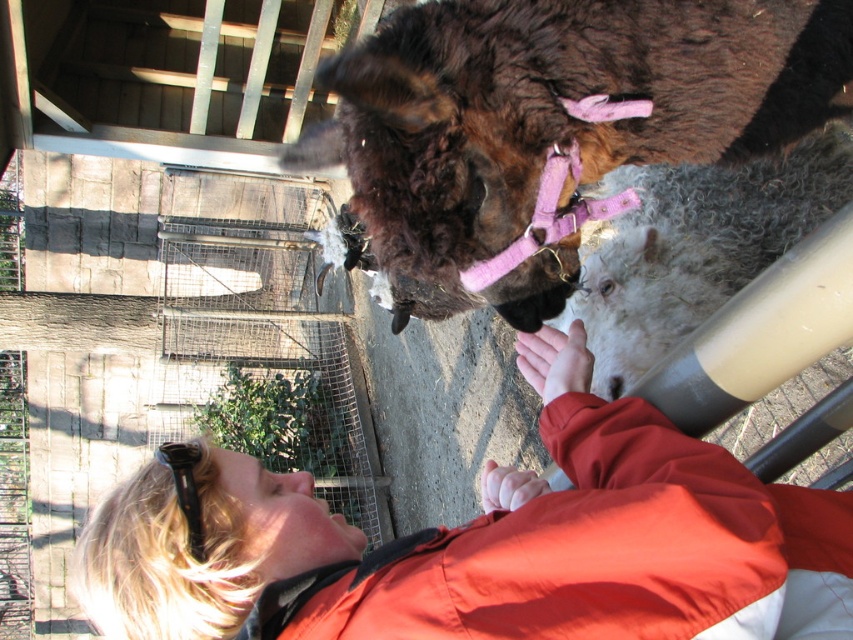
You are standing in the farm enclosure and want to reach a treat that is at point (306, 484). There is an obstacle at point (498, 35). Will you encounter the obstacle before reaching the treat?

Point (306, 484) is further to the viewer than point (498, 35), so you will reach the treat before encountering the obstacle.

In the scene shown: You are standing in a farm setting and see the blonde hair at upper left and the brown fuzzy llama at upper center. Which object is located to the left of the other?

The blonde hair at upper left is positioned on the left side of brown fuzzy llama at upper center.